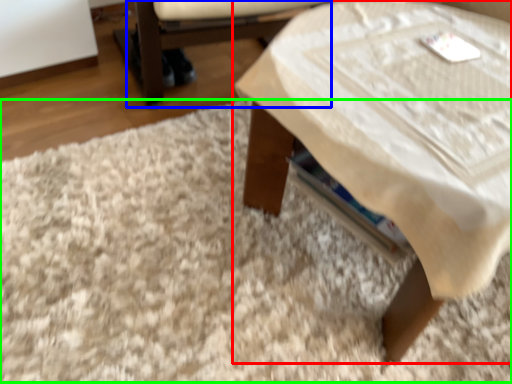
Question: Which object is positioned closest to table (highlighted by a red box)? Select from armchair (highlighted by a blue box) and mat (highlighted by a green box).

Choices:
 (A) armchair
 (B) mat

Answer: (B)